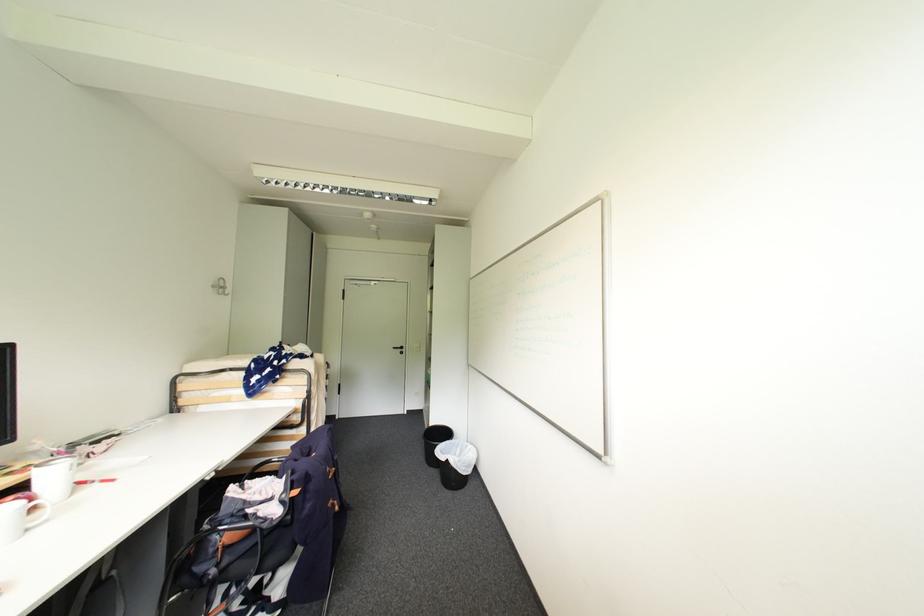
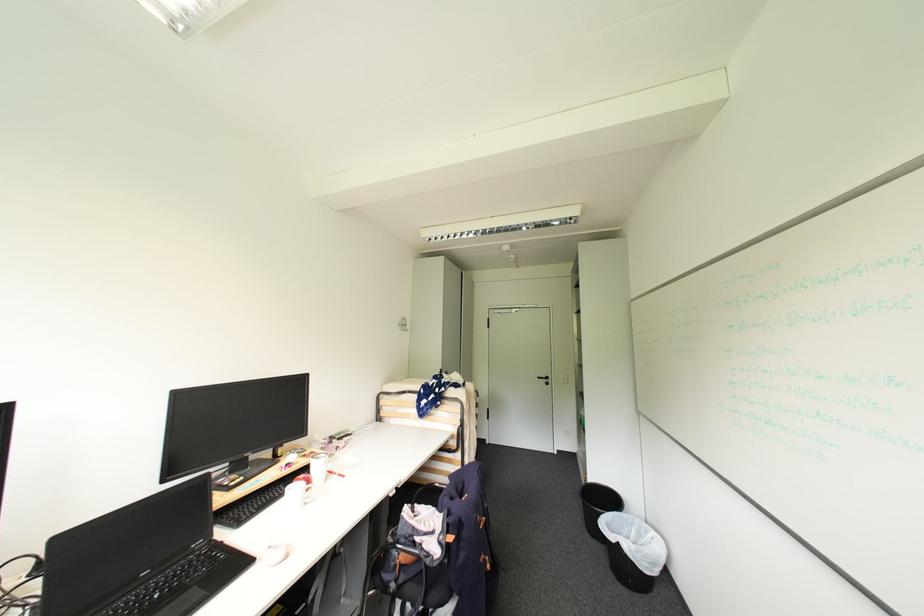
The point at [290,496] is marked in the first image. Where is the corresponding point in the second image?

(447, 538)